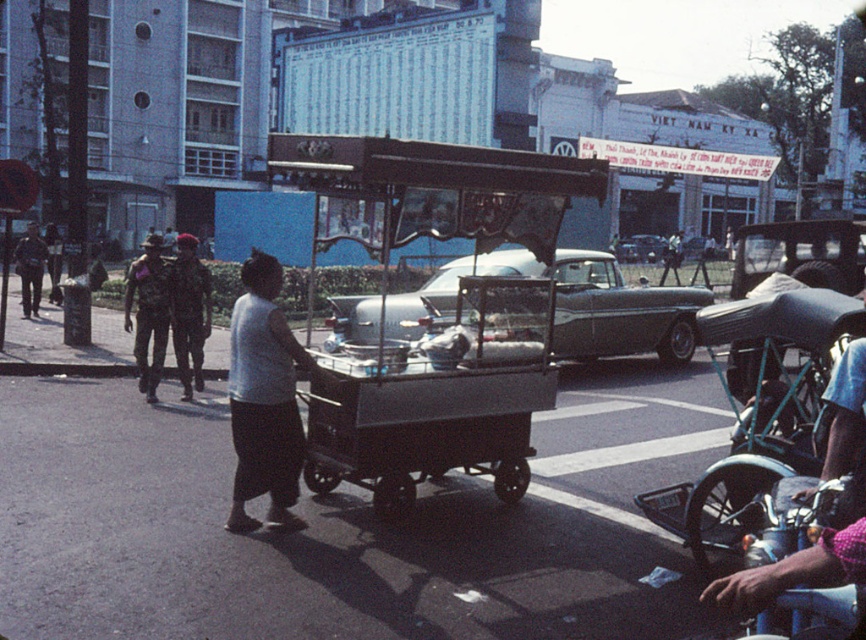
Question: Which of these objects is positioned closest to the camouflage uniform at left?

Choices:
 (A) silver metallic car at center
 (B) metallic silver cart at center
 (C) camouflage fabric uniform at left
 (D) silver metallic sedan at center

Answer: (C)

Question: Is camouflage uniform at center bigger than camouflage uniform at left?

Choices:
 (A) no
 (B) yes

Answer: (A)

Question: Observing the image, what is the correct spatial positioning of camouflage uniform at center in reference to camouflage uniform at left?

Choices:
 (A) right
 (B) left

Answer: (A)

Question: Based on their relative distances, which object is farther from the camouflage uniform at left?

Choices:
 (A) white matte shirt at center
 (B) silver metallic car at center

Answer: (A)

Question: Which point is closer to the camera taking this photo?

Choices:
 (A) (36, 273)
 (B) (201, 332)

Answer: (B)

Question: Does camouflage uniform at center have a greater width compared to silver metallic sedan at center?

Choices:
 (A) yes
 (B) no

Answer: (B)